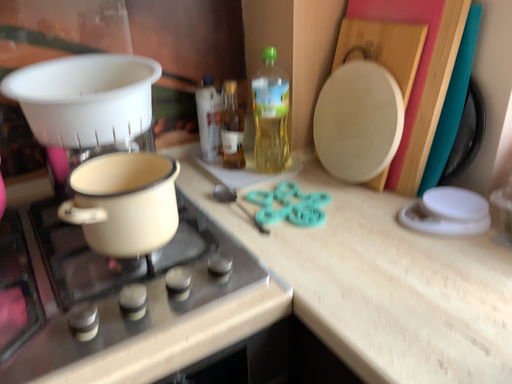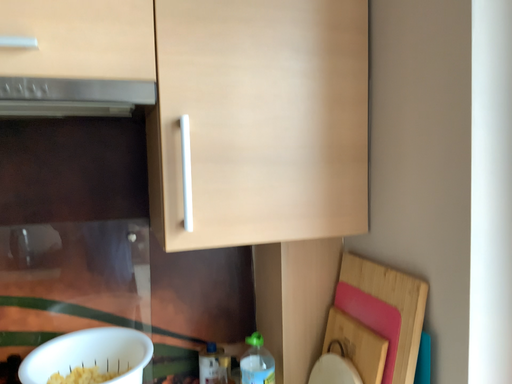
Question: How did the camera likely rotate when shooting the video?

Choices:
 (A) rotated upward
 (B) rotated downward

Answer: (A)